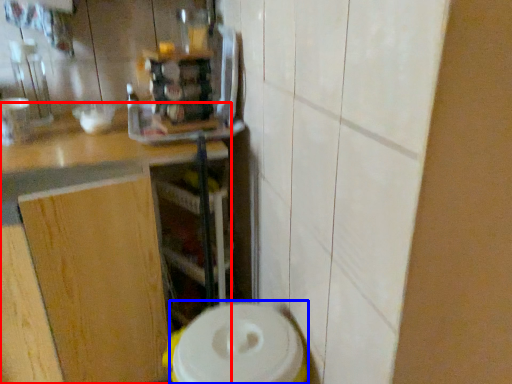
Question: Which of the following is the closest to the observer, countertop (highlighted by a red box) or appliance (highlighted by a blue box)?

Choices:
 (A) countertop
 (B) appliance

Answer: (B)